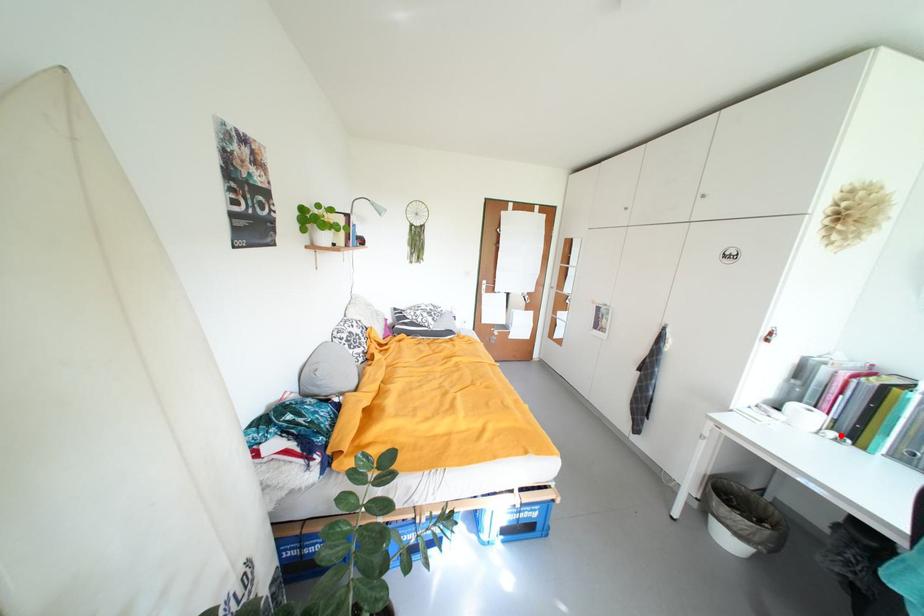
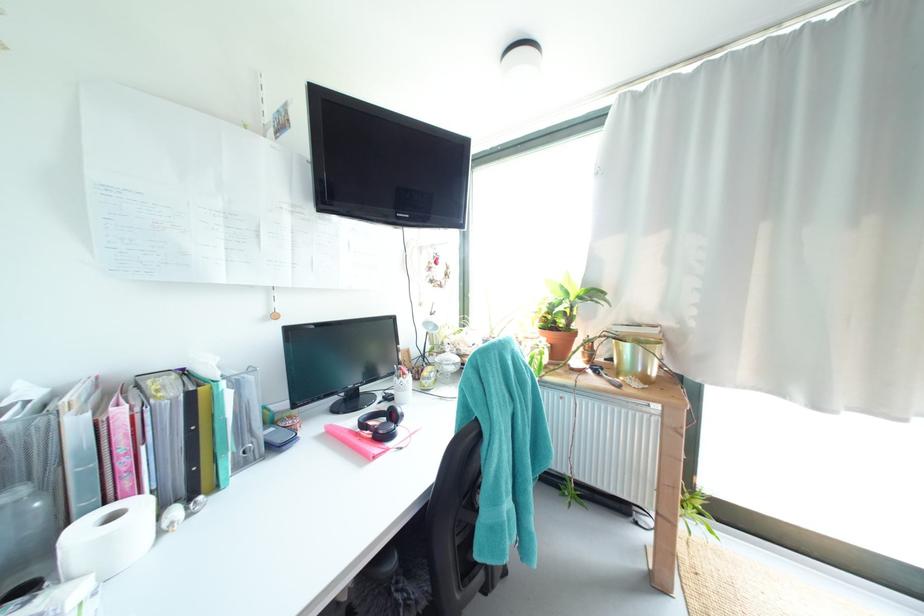
Question: I am providing you with two images of the same scene from different viewpoints. A red point is marked on the first image. Can you still see the location of the red point in image 2?

Choices:
 (A) Yes
 (B) No

Answer: (A)